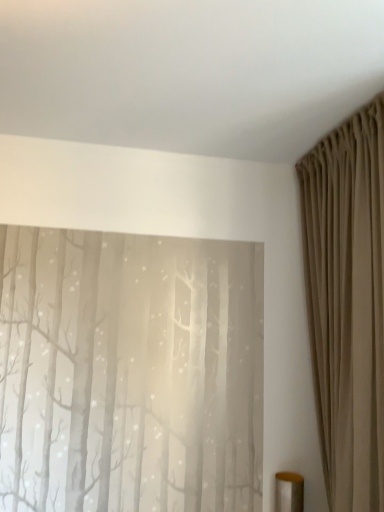
Question: Is metallic gold cylinder at lower right oriented towards beige fabric curtain at right?

Choices:
 (A) yes
 (B) no

Answer: (A)

Question: Would you say metallic gold cylinder at lower right contains beige fabric curtain at right?

Choices:
 (A) no
 (B) yes

Answer: (A)

Question: Does metallic gold cylinder at lower right appear on the right side of beige fabric curtain at right?

Choices:
 (A) no
 (B) yes

Answer: (A)

Question: Is metallic gold cylinder at lower right outside of beige fabric curtain at right?

Choices:
 (A) yes
 (B) no

Answer: (B)

Question: Is the depth of metallic gold cylinder at lower right greater than that of beige fabric curtain at right?

Choices:
 (A) yes
 (B) no

Answer: (A)

Question: From the image's perspective, is metallic gold cylinder at lower right over beige fabric curtain at right?

Choices:
 (A) no
 (B) yes

Answer: (A)

Question: Is beige fabric curtain at right next to metallic gold cylinder at lower right and touching it?

Choices:
 (A) yes
 (B) no

Answer: (B)

Question: From a real-world perspective, is beige fabric curtain at right over metallic gold cylinder at lower right?

Choices:
 (A) no
 (B) yes

Answer: (B)

Question: Could metallic gold cylinder at lower right be considered to be inside beige fabric curtain at right?

Choices:
 (A) no
 (B) yes

Answer: (B)

Question: Is metallic gold cylinder at lower right at the back of beige fabric curtain at right?

Choices:
 (A) no
 (B) yes

Answer: (A)

Question: Does beige fabric curtain at right have a lesser width compared to metallic gold cylinder at lower right?

Choices:
 (A) yes
 (B) no

Answer: (B)

Question: Can you confirm if beige fabric curtain at right is shorter than metallic gold cylinder at lower right?

Choices:
 (A) no
 (B) yes

Answer: (A)

Question: From the image's perspective, is beige fabric curtain at right located above or below metallic gold cylinder at lower right?

Choices:
 (A) above
 (B) below

Answer: (A)